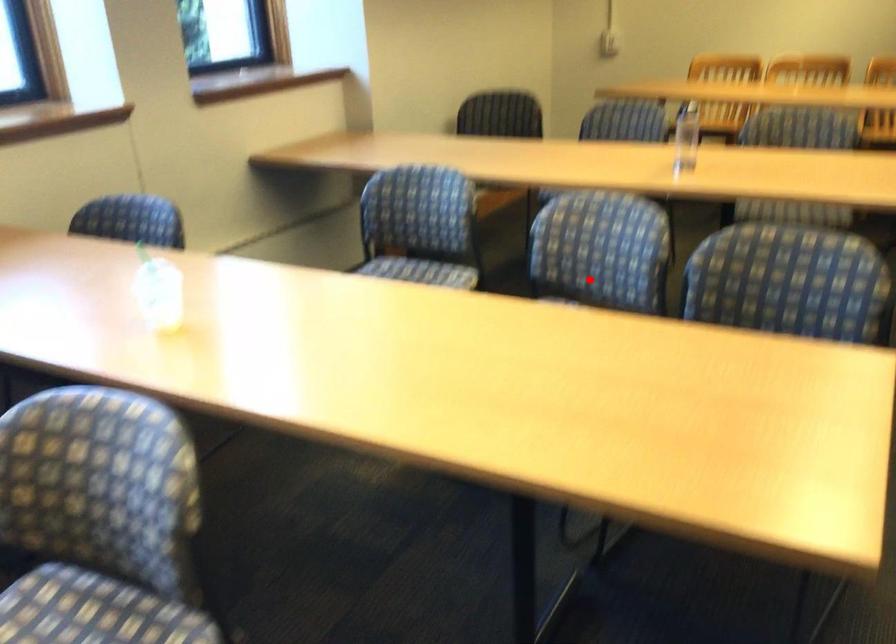
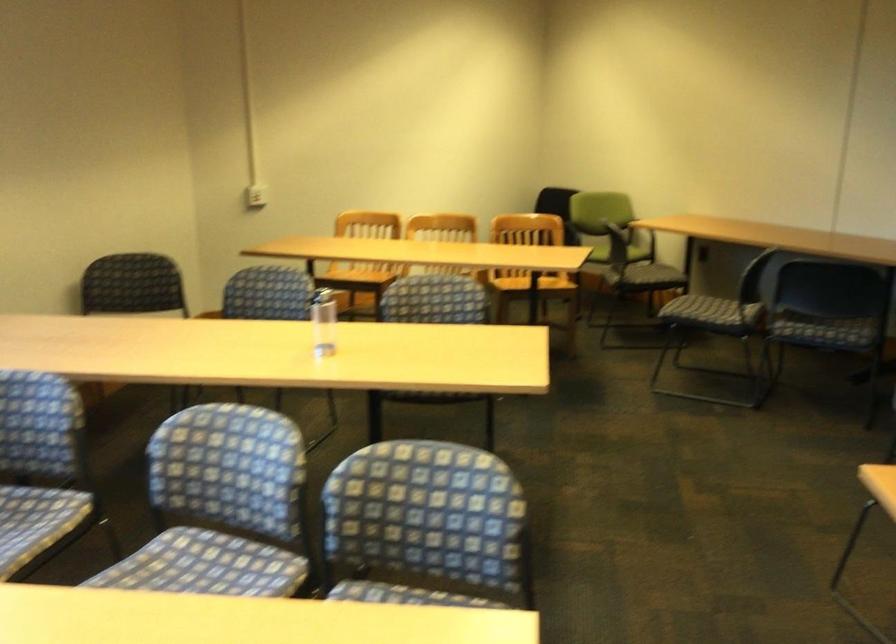
Question: I am providing you with two images of the same scene from different viewpoints. Image1 has a red point marked. In image2, the corresponding 3D location appears at what relative position? Reply with the corresponding letter.

Choices:
 (A) Closer
 (B) Farther

Answer: (A)